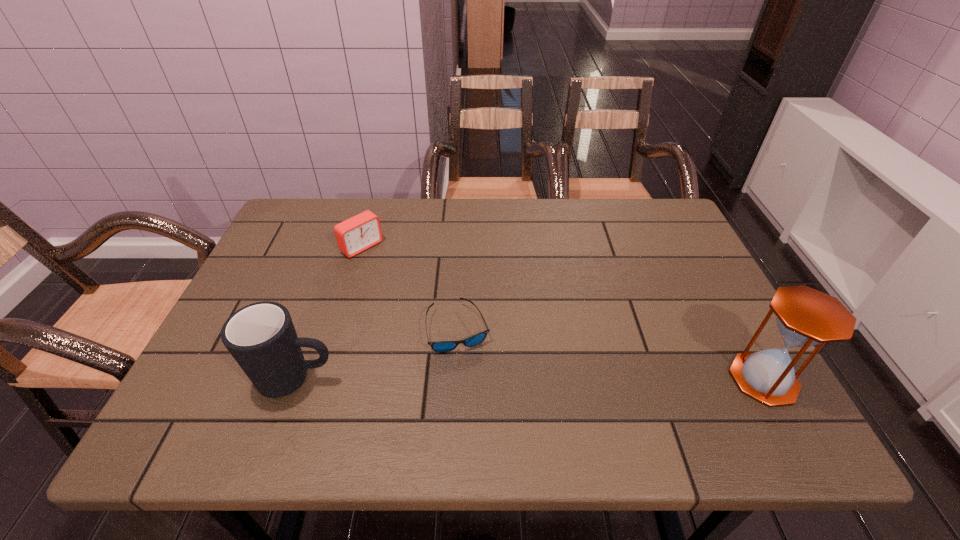
At what (x,y) coordinates should I click in order to perform the action: click on free spot on the desktop that is between the second tallest object and the rightmost object and is positioned at the front of the shortest object showing the lenses. Please return your answer as a coordinate pair (x, y). The height and width of the screenshot is (540, 960). Looking at the image, I should click on (537, 380).

Find the location of a particular element. The image size is (960, 540). vacant spot on the desktop that is between the mug and the tallest object and is positioned on the front-facing side of the alarm clock is located at coordinates (526, 380).